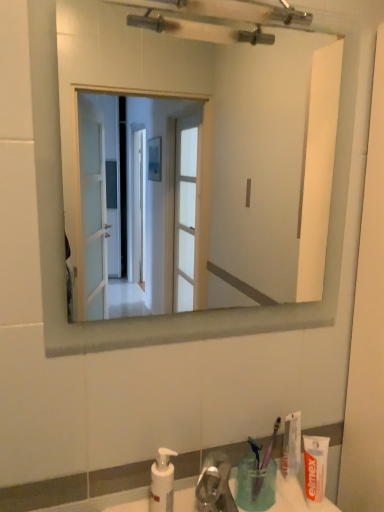
Question: Is white glossy mirror at upper center positioned before white matte toothpaste at lower right, positioned as the 2th toothpaste in front-to-back order?

Choices:
 (A) no
 (B) yes

Answer: (B)

Question: From a real-world perspective, is white glossy mirror at upper center positioned under white matte toothpaste at lower right, the 1th toothpaste viewed from the back, based on gravity?

Choices:
 (A) yes
 (B) no

Answer: (B)

Question: Is white glossy mirror at upper center completely or partially outside of white matte toothpaste at lower right, the 1th toothpaste viewed from the back?

Choices:
 (A) no
 (B) yes

Answer: (B)

Question: Is white glossy mirror at upper center taller than white matte toothpaste at lower right, the 1th toothpaste viewed from the back?

Choices:
 (A) no
 (B) yes

Answer: (B)

Question: From a real-world perspective, is white glossy mirror at upper center positioned over white matte toothpaste at lower right, the 1th toothpaste viewed from the back, based on gravity?

Choices:
 (A) no
 (B) yes

Answer: (B)

Question: Is white glossy mirror at upper center at the right side of white matte toothpaste at lower right, the 1th toothpaste viewed from the back?

Choices:
 (A) no
 (B) yes

Answer: (A)

Question: Is white plastic soap dispenser at lower center at the left side of translucent plastic cup at lower right?

Choices:
 (A) no
 (B) yes

Answer: (B)

Question: Does white plastic soap dispenser at lower center have a greater width compared to translucent plastic cup at lower right?

Choices:
 (A) yes
 (B) no

Answer: (B)

Question: Is translucent plastic cup at lower right a part of white plastic soap dispenser at lower center?

Choices:
 (A) no
 (B) yes

Answer: (A)

Question: From a real-world perspective, is white plastic soap dispenser at lower center physically above translucent plastic cup at lower right?

Choices:
 (A) no
 (B) yes

Answer: (B)

Question: Considering the relative positions of white plastic soap dispenser at lower center and translucent plastic cup at lower right in the image provided, is white plastic soap dispenser at lower center to the right of translucent plastic cup at lower right from the viewer's perspective?

Choices:
 (A) no
 (B) yes

Answer: (A)

Question: Would you say white plastic soap dispenser at lower center is a long distance from translucent plastic cup at lower right?

Choices:
 (A) no
 (B) yes

Answer: (A)

Question: Considering the relative sizes of translucent plastic cup at lower right and purple plastic toothbrush at lower right, which appears as the 1th toothbrush when viewed from the right, in the image provided, is translucent plastic cup at lower right shorter than purple plastic toothbrush at lower right, which appears as the 1th toothbrush when viewed from the right,?

Choices:
 (A) no
 (B) yes

Answer: (B)